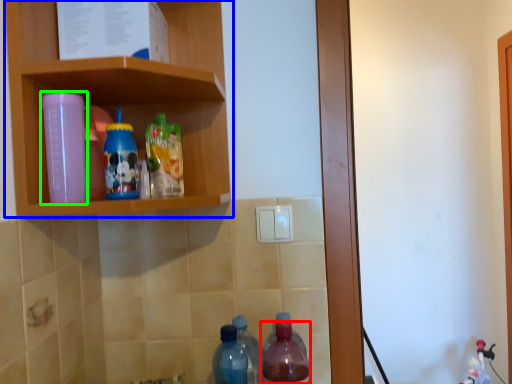
Question: Based on their relative distances, which object is nearer to bottle (highlighted by a red box)? Choose from shelf (highlighted by a blue box) and bottle (highlighted by a green box).

Choices:
 (A) shelf
 (B) bottle

Answer: (A)